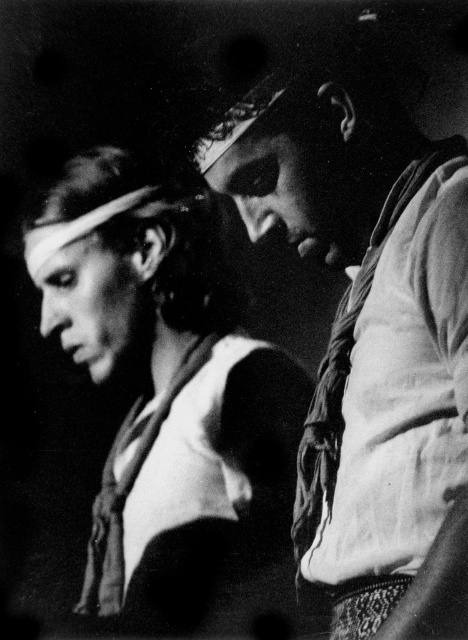
Who is higher up, white fabric shirt at right or matte white scarf at center?

white fabric shirt at right is higher up.

Between point (373, 490) and point (270, 468), which one is positioned behind?

Positioned behind is point (270, 468).

Measure the distance between point [446,461] and camera.

Point [446,461] is 1.28 meters away from camera.

You are a GUI agent. You are given a task and a screenshot of the screen. Output one action in this format:
    pyautogui.click(x=<x>, y=<y>)
    Task: Click on the white fabric shirt at right
    The image size is (468, 640).
    Given the screenshot: What is the action you would take?
    pyautogui.click(x=366, y=328)